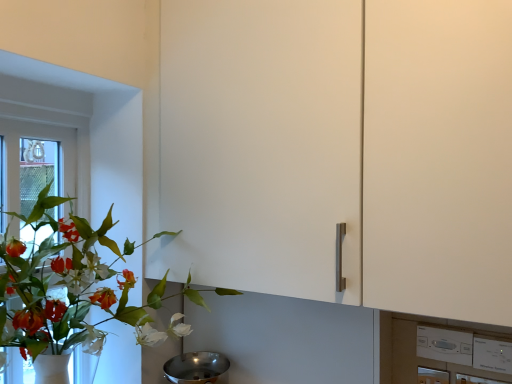
Question: Is green matte plant at left bigger than white plastic switch at lower right?

Choices:
 (A) no
 (B) yes

Answer: (B)

Question: Is green matte plant at left at the right side of white plastic switch at lower right?

Choices:
 (A) yes
 (B) no

Answer: (B)

Question: From the image's perspective, would you say green matte plant at left is positioned over white plastic switch at lower right?

Choices:
 (A) no
 (B) yes

Answer: (B)

Question: Does green matte plant at left have a lesser height compared to white plastic switch at lower right?

Choices:
 (A) no
 (B) yes

Answer: (A)

Question: Is green matte plant at left not close to white plastic switch at lower right?

Choices:
 (A) no
 (B) yes

Answer: (B)

Question: Considering the relative sizes of green matte plant at left and white plastic switch at lower right in the image provided, is green matte plant at left smaller than white plastic switch at lower right?

Choices:
 (A) yes
 (B) no

Answer: (B)

Question: Can you confirm if polished stainless steel mixing bowl at lower center is smaller than green matte plant at left?

Choices:
 (A) yes
 (B) no

Answer: (A)

Question: From a real-world perspective, does polished stainless steel mixing bowl at lower center stand above green matte plant at left?

Choices:
 (A) no
 (B) yes

Answer: (A)

Question: Is polished stainless steel mixing bowl at lower center surrounding green matte plant at left?

Choices:
 (A) no
 (B) yes

Answer: (A)

Question: Can you confirm if polished stainless steel mixing bowl at lower center is shorter than green matte plant at left?

Choices:
 (A) no
 (B) yes

Answer: (B)

Question: Could you tell me if polished stainless steel mixing bowl at lower center is turned towards green matte plant at left?

Choices:
 (A) no
 (B) yes

Answer: (A)

Question: Is polished stainless steel mixing bowl at lower center bigger than green matte plant at left?

Choices:
 (A) no
 (B) yes

Answer: (A)

Question: Does polished stainless steel mixing bowl at lower center have a lesser height compared to white plastic switch at lower right?

Choices:
 (A) no
 (B) yes

Answer: (A)